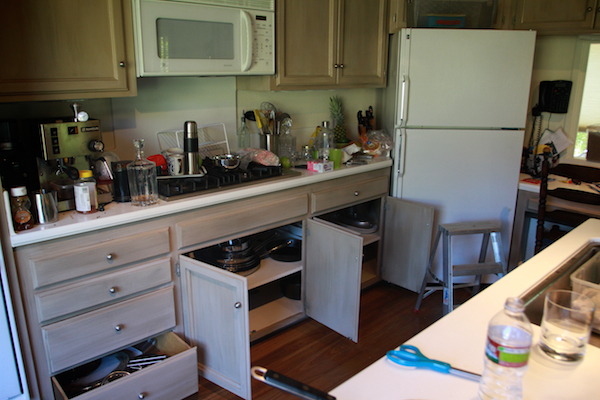
Where is `open drawer`? open drawer is located at coordinates (176, 345), (188, 357), (178, 389), (138, 394), (119, 382), (61, 382), (159, 350), (69, 396).